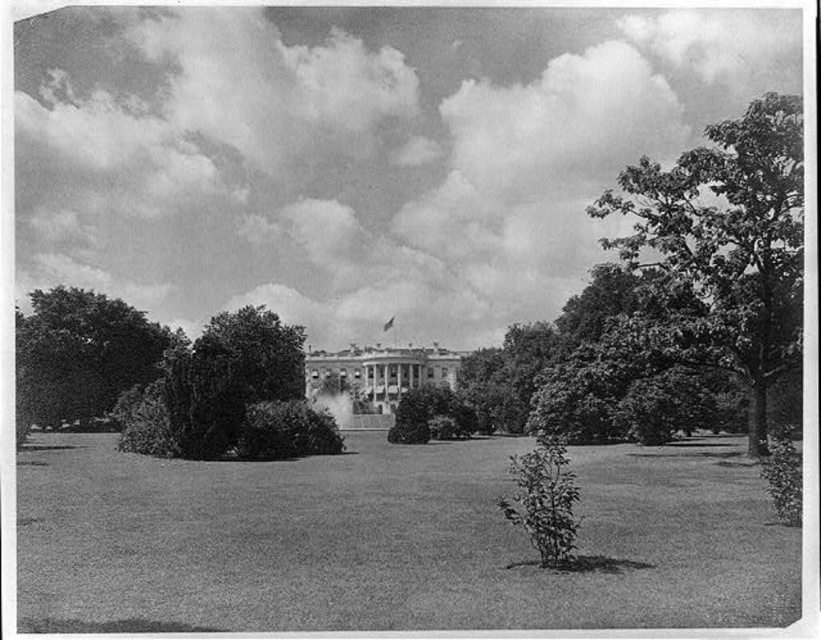
Between smooth green tree at right and dark green leafy tree at left, which one is positioned higher?

smooth green tree at right

Which of these two, smooth green tree at right or dark green leafy tree at left, stands taller?

With more height is smooth green tree at right.

Who is more distant from viewer, (785, 104) or (104, 390)?

The point (104, 390) is more distant.

The height and width of the screenshot is (640, 821). Identify the location of smooth green tree at right. (723, 248).

Who is positioned more to the right, smooth green tree at right or thick green bush at center?

Positioned to the right is smooth green tree at right.

Describe the element at coordinates (723, 248) in the screenshot. The height and width of the screenshot is (640, 821). I see `smooth green tree at right` at that location.

Does point (774, 156) lie in front of point (324, 413)?

That is True.

Where is `smooth green tree at right`? Image resolution: width=821 pixels, height=640 pixels. smooth green tree at right is located at coordinates (723, 248).

Does smooth green tree at right appear over green leafy bush at center?

Yes, smooth green tree at right is above green leafy bush at center.

This screenshot has width=821, height=640. What do you see at coordinates (723, 248) in the screenshot?
I see `smooth green tree at right` at bounding box center [723, 248].

Does point (723, 132) lie in front of point (455, 403)?

Yes, point (723, 132) is closer to viewer.

At what (x,y) coordinates should I click in order to perform the action: click on smooth green tree at right. Please return your answer as a coordinate pair (x, y). The width and height of the screenshot is (821, 640). Looking at the image, I should click on (723, 248).